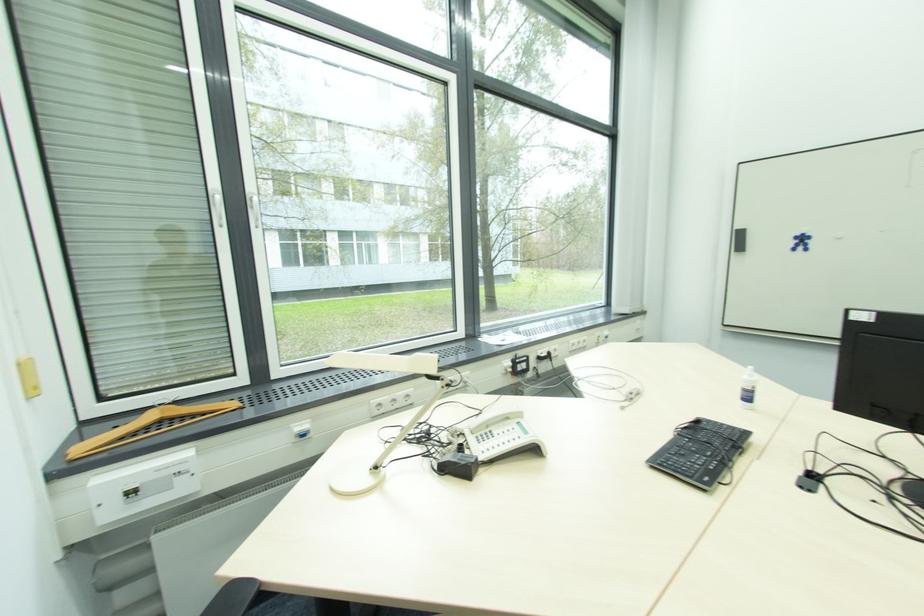
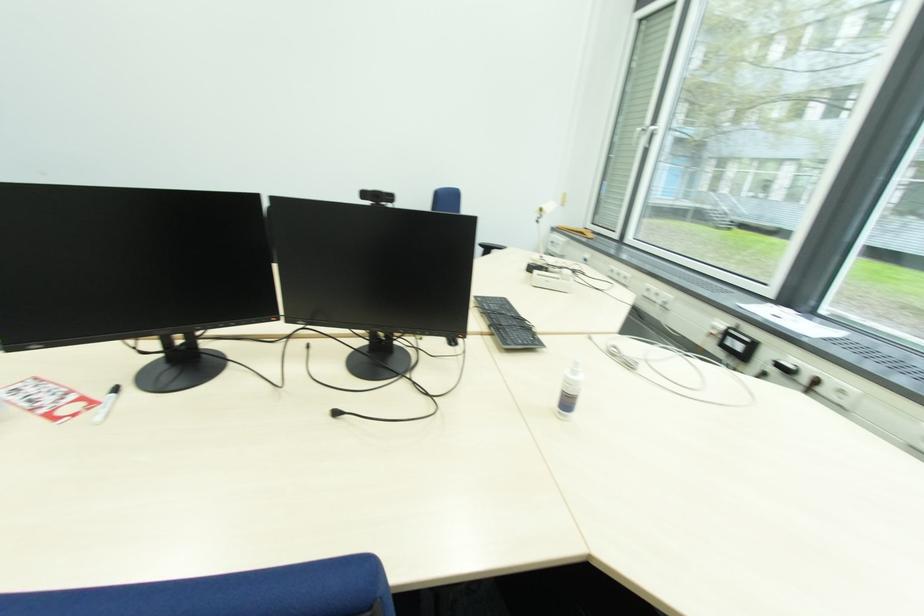
Where in the second image is the point corresponding to (x=750, y=400) from the first image?

(570, 405)